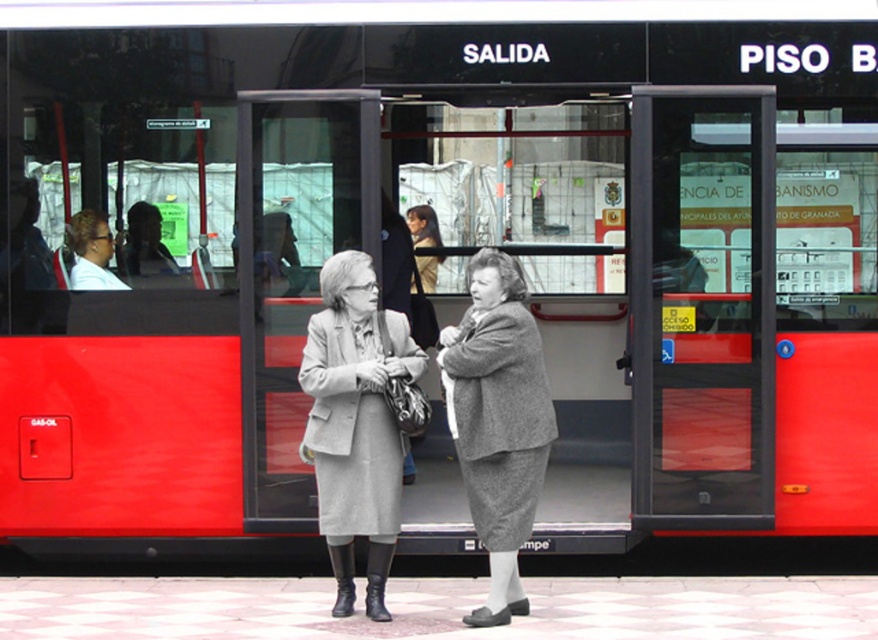
You are at the bus stop and see two women wearing gray wool coats. One is wearing a gray wool coat at center and the other a gray woolen suit at center. Which one is positioned lower?

The gray wool coat at center is positioned below the gray woolen suit at center, so the gray wool coat at center is lower.

You are a photographer at the bus stop and want to capture both the gray wool coat at center and the gray woolen suit at center in the same frame. Which object should you position closer to the left side of your camera viewfinder to include both?

To include both the gray wool coat at center and the gray woolen suit at center in the same frame, position the gray wool coat at center closer to the left side of your camera viewfinder since it is already on the left side of the gray woolen suit at center.

Based on the photo, you are a photographer trying to capture both the gray wool coat at center and the gray woolen suit at center in a single frame. The minimum distance your camera can focus on two objects clearly is 18 inches. Can you fit both into the frame without blurring either?

The gray wool coat at center is 18.42 inches from the gray woolen suit at center. Since the minimum focus distance is 18 inches, the distance between them is slightly more than the minimum requirement. Therefore, the camera might struggle to keep both in focus simultaneously, resulting in one being blurred.